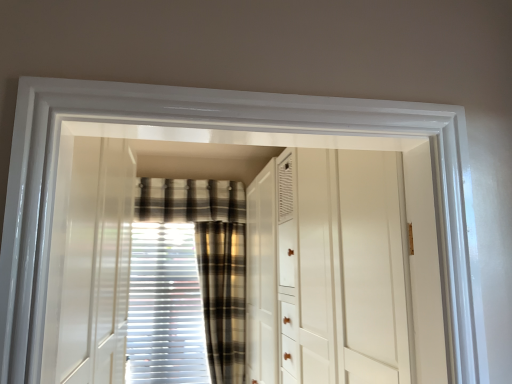
Find the location of `free spot above plaid fabric curtain at center, which is the 2th curtain in left-to-right order (from a real-world perspective)`. free spot above plaid fabric curtain at center, which is the 2th curtain in left-to-right order (from a real-world perspective) is located at coordinates (219, 215).